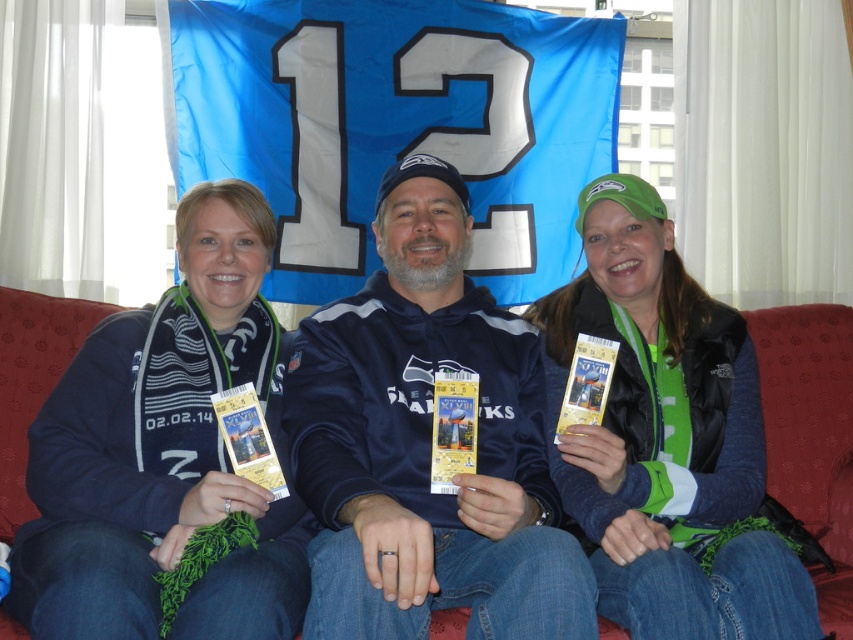
Does dark blue hoodie at center appear under green fabric vest at center?

No, dark blue hoodie at center is not below green fabric vest at center.

Can you confirm if dark blue hoodie at center is wider than green fabric vest at center?

Yes, dark blue hoodie at center is wider than green fabric vest at center.

Does point (445, 228) come behind point (676, 499)?

Yes.

In order to click on dark blue hoodie at center in this screenshot , I will do `click(426, 444)`.

Is green fabric vest at center to the left of red fabric couch at center from the viewer's perspective?

Indeed, green fabric vest at center is positioned on the left side of red fabric couch at center.

Looking at this image, does green fabric vest at center have a lesser height compared to red fabric couch at center?

In fact, green fabric vest at center may be taller than red fabric couch at center.

Does point (596, 577) come closer to viewer compared to point (838, 632)?

Yes, point (596, 577) is closer to viewer.

Where is `green fabric vest at center`? The width and height of the screenshot is (853, 640). green fabric vest at center is located at coordinates (666, 436).

Does point (337, 378) come behind point (99, 560)?

Yes, point (337, 378) is farther from viewer.

Locate an element on the screen. Image resolution: width=853 pixels, height=640 pixels. dark blue hoodie at center is located at coordinates (426, 444).

Between point (363, 582) and point (186, 364), which one is positioned in front?

Point (363, 582) is in front.

The image size is (853, 640). In order to click on dark blue hoodie at center in this screenshot , I will do `click(426, 444)`.